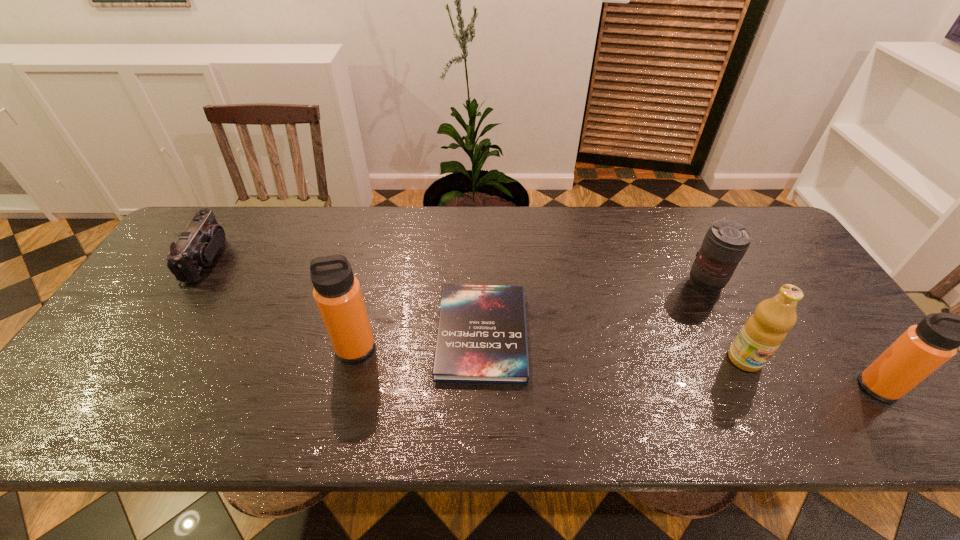
Please point a spot to place another thermos_bottle for symmetrical spacing. Please provide its 2D coordinates. Your answer should be formatted as a tuple, i.e. [(x, y)], where the tuple contains the x and y coordinates of a point satisfying the conditions above.

[(607, 367)]